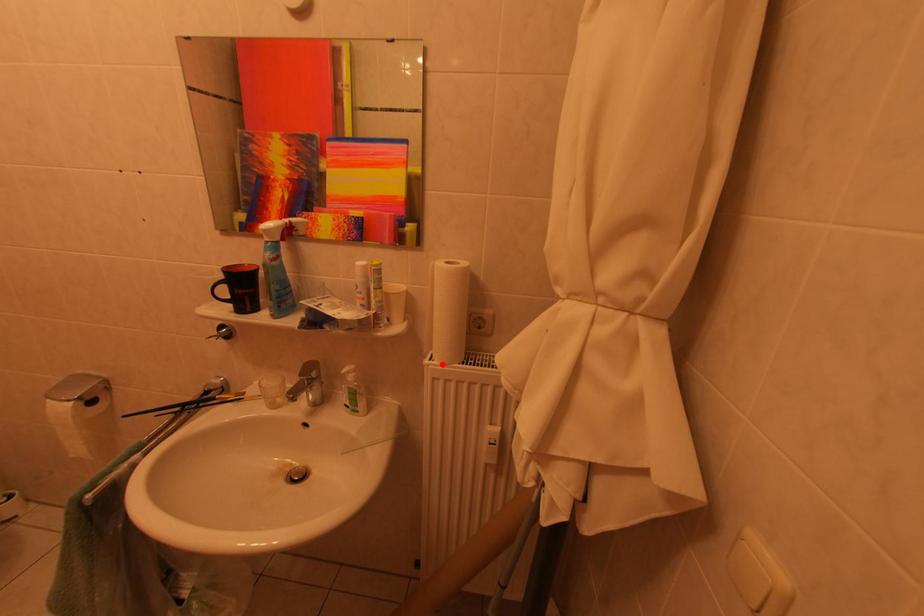
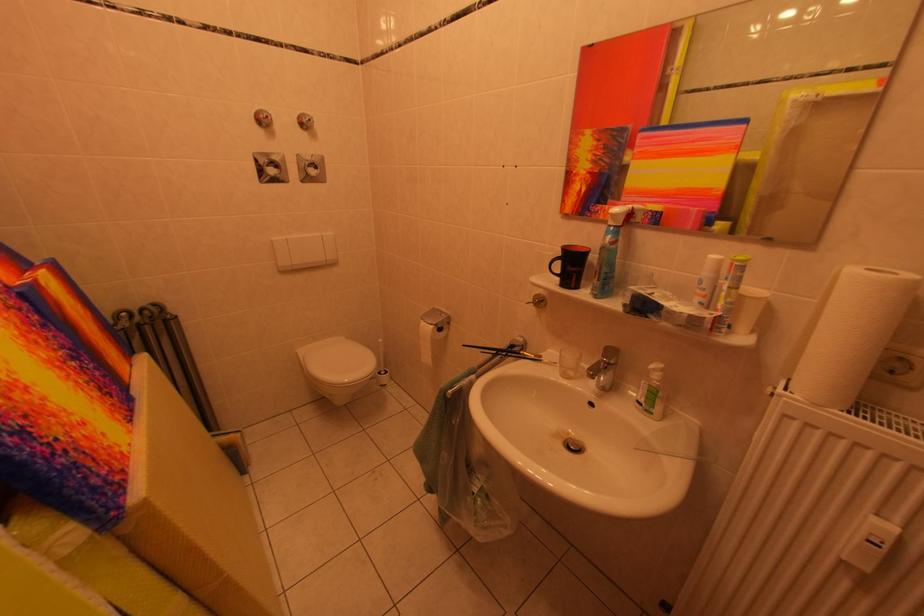
Find the pixel in the second image that matches the highlighted location in the first image.

(800, 397)